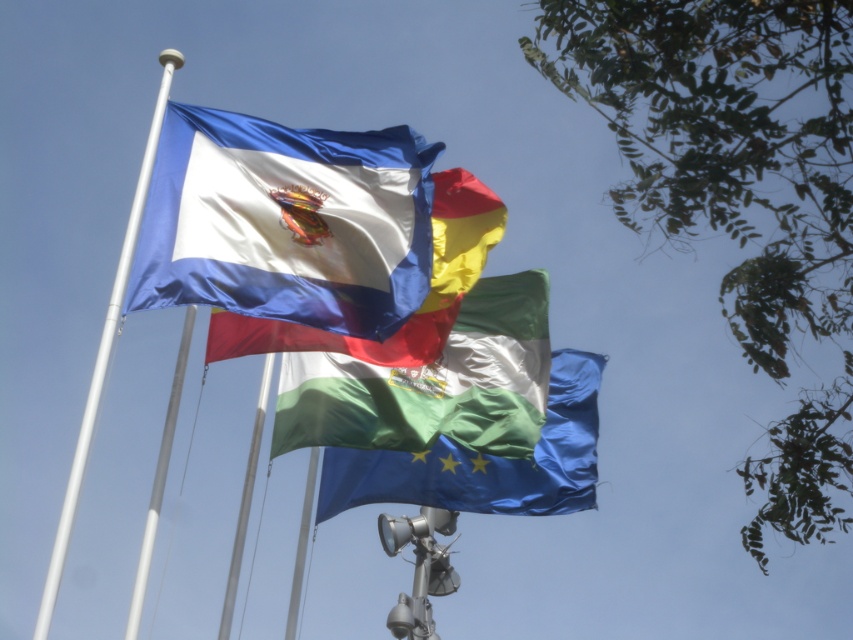
You are standing in front of the flagpole and see two points marked on the flagpole. One is at point coordinates point (395, 284) and the other is at point coordinates point (408, 500). Which point is closer to you?

Point (395, 284) is closer to the viewer than point (408, 500).

You are a photographer trying to capture the entire scene of the flags. You notice the satin blue flag at upper center and the white glossy flag pole at left. Which one is smaller in size?

The satin blue flag at upper center is smaller than the white glossy flag pole at left.